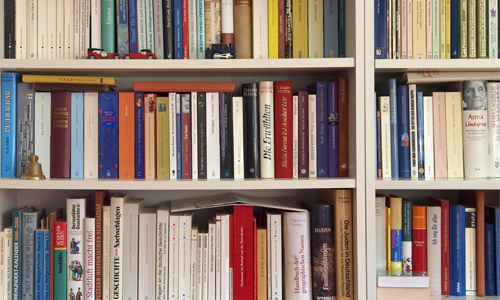
Image resolution: width=500 pixels, height=300 pixels. I want to click on bric a brac, so click(26, 175), click(100, 56), click(128, 54), click(222, 54).